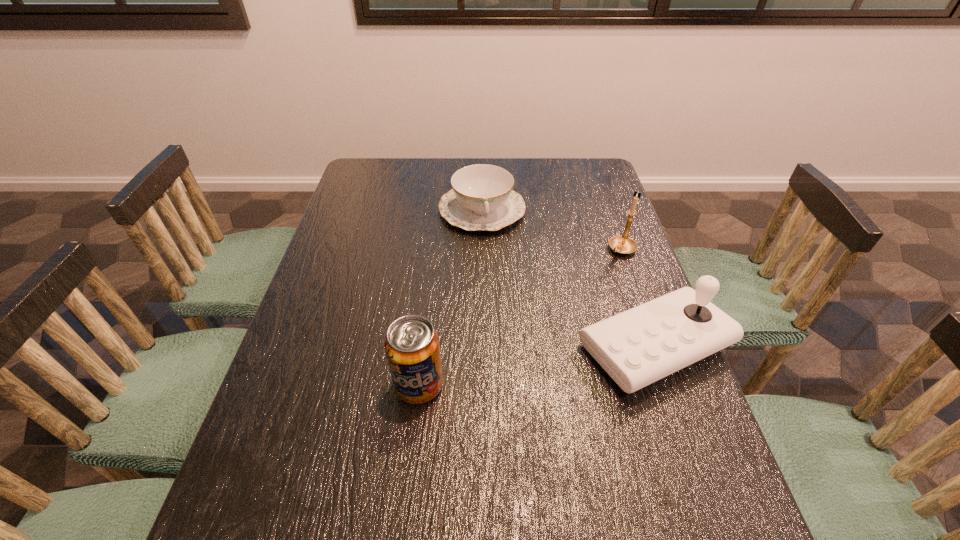
Find the location of a particular element. Image resolution: width=960 pixels, height=540 pixels. soda can is located at coordinates (412, 347).

Where is `joystick`? joystick is located at coordinates pos(637,347).

Locate an element on the screen. This screenshot has height=540, width=960. the third nearest object is located at coordinates (622, 244).

Where is `the shortest object`? The width and height of the screenshot is (960, 540). the shortest object is located at coordinates (482, 198).

Where is `the farthest object`? This screenshot has width=960, height=540. the farthest object is located at coordinates (482, 198).

Identify the location of vacant space situated on the back of the soda can. (424, 340).

Find the location of a particular element. The width and height of the screenshot is (960, 540). free location located on the left of the joystick is located at coordinates (522, 346).

This screenshot has height=540, width=960. In order to click on free space located 0.090m on the handle side of the candle holder in this screenshot , I will do `click(600, 274)`.

The height and width of the screenshot is (540, 960). In order to click on vacant space situated 0.400m on the handle side of the candle holder in this screenshot , I will do `click(534, 342)`.

Identify the location of vacant space located 0.210m on the handle side of the candle holder. (577, 298).